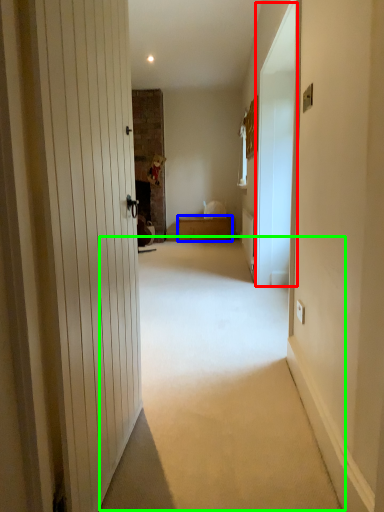
Question: Which object is positioned farthest from screen door (highlighted by a red box)? Select from furniture (highlighted by a blue box) and corridor (highlighted by a green box).

Choices:
 (A) furniture
 (B) corridor

Answer: (A)